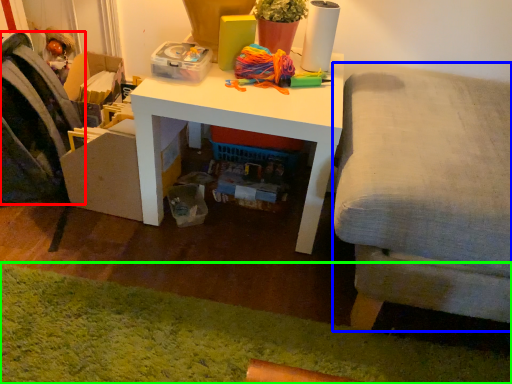
Question: Which object is the closest to the swivel chair (highlighted by a red box)? Choose among these: studio couch (highlighted by a blue box) or mat (highlighted by a green box).

Choices:
 (A) studio couch
 (B) mat

Answer: (B)